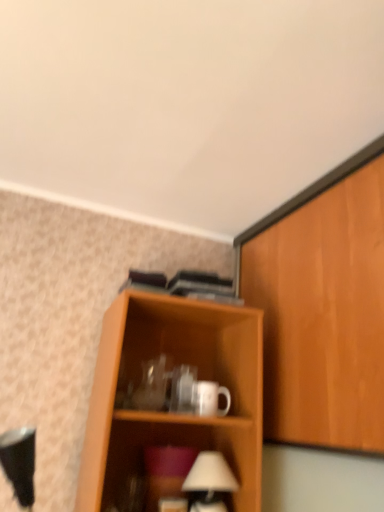
Image resolution: width=384 pixels, height=512 pixels. Describe the element at coordinates (209, 398) in the screenshot. I see `white glossy mug at center` at that location.

Locate an element on the screen. The width and height of the screenshot is (384, 512). wooden cabinet at right is located at coordinates (322, 307).

What do you see at coordinates (209, 482) in the screenshot?
I see `white matte table lamp at lower center` at bounding box center [209, 482].

Where is `white glossy mug at center`? This screenshot has width=384, height=512. white glossy mug at center is located at coordinates (209, 398).

In the image, there is a white matte table lamp at lower center. What are the coordinates of `mug above it (from the image's perspective)` in the screenshot? It's located at pyautogui.click(x=209, y=398).

From the picture: Considering the positions of objects white matte table lamp at lower center and white glossy mug at center in the image provided, who is more to the left, white matte table lamp at lower center or white glossy mug at center?

Positioned to the left is white matte table lamp at lower center.

Is white matte table lamp at lower center not inside white glossy mug at center?

Yes, white matte table lamp at lower center is located beyond the bounds of white glossy mug at center.

Is white matte table lamp at lower center positioned behind white glossy mug at center?

No, white matte table lamp at lower center is closer to the viewer.

Could white glossy mug at center be considered to be inside wooden cabinet at right?

Actually, white glossy mug at center is outside wooden cabinet at right.

Consider the image. From a real-world perspective, is wooden cabinet at right located higher than white glossy mug at center?

Correct, in the physical world, wooden cabinet at right is higher than white glossy mug at center.

Can you tell me how much wooden cabinet at right and white glossy mug at center differ in facing direction?

wooden cabinet at right and white glossy mug at center are facing 86.6 degrees away from each other.

Which is further, (x=342, y=170) or (x=203, y=411)?

Point (x=203, y=411)

Is white glossy mug at center to the left of wooden cabinet at right from the viewer's perspective?

Yes, white glossy mug at center is to the left of wooden cabinet at right.

Which of these two, white glossy mug at center or wooden cabinet at right, stands taller?

With more height is wooden cabinet at right.

From the image's perspective, is white glossy mug at center beneath wooden cabinet at right?

Yes.

Consider the image. Between wooden cabinet at right and white matte table lamp at lower center, which one appears on the right side from the viewer's perspective?

wooden cabinet at right.

Can you confirm if wooden cabinet at right is thinner than white matte table lamp at lower center?

Yes, wooden cabinet at right is thinner than white matte table lamp at lower center.

From a real-world perspective, is wooden cabinet at right positioned under white matte table lamp at lower center based on gravity?

Incorrect, from a real-world perspective, wooden cabinet at right is higher than white matte table lamp at lower center.

Measure the distance from wooden cabinet at right to white matte table lamp at lower center.

wooden cabinet at right and white matte table lamp at lower center are 20.62 inches apart.

Considering the positions of objects white glossy mug at center and white matte table lamp at lower center in the image provided, who is more to the right, white glossy mug at center or white matte table lamp at lower center?

white glossy mug at center.

Considering their positions, is white glossy mug at center located in front of or behind white matte table lamp at lower center?

white glossy mug at center is behind white matte table lamp at lower center.

From a real-world perspective, which object rests below the other?

white matte table lamp at lower center.

Where is `table lamp on the left side of white glossy mug at center`? This screenshot has width=384, height=512. table lamp on the left side of white glossy mug at center is located at coordinates (209, 482).

Based on the photo, how many degrees apart are the facing directions of white matte table lamp at lower center and wooden cabinet at right?

There is a 86.6-degree angle between the facing directions of white matte table lamp at lower center and wooden cabinet at right.

Is white matte table lamp at lower center not within wooden cabinet at right?

Indeed, white matte table lamp at lower center is completely outside wooden cabinet at right.

From a real-world perspective, who is located higher, white matte table lamp at lower center or wooden cabinet at right?

wooden cabinet at right, from a real-world perspective.

Is white matte table lamp at lower center positioned in front of wooden cabinet at right?

No, the depth of white matte table lamp at lower center is greater than that of wooden cabinet at right.

This screenshot has width=384, height=512. Find the location of `mug behind the white matte table lamp at lower center`. mug behind the white matte table lamp at lower center is located at coordinates (209, 398).

In the image, there is a wooden cabinet at right. In order to click on mug below it (from the image's perspective) in this screenshot , I will do pyautogui.click(x=209, y=398).

Which object lies nearer to the anchor point white glossy mug at center, wooden cabinet at right or white matte table lamp at lower center?

white matte table lamp at lower center lies closer to white glossy mug at center than the other object.

Considering their positions, is white glossy mug at center positioned closer to wooden cabinet at right than white matte table lamp at lower center?

Based on the image, white glossy mug at center appears to be nearer to wooden cabinet at right.

Estimate the real-world distances between objects in this image. Which object is further from white matte table lamp at lower center, wooden cabinet at right or white glossy mug at center?

Among the two, wooden cabinet at right is located further to white matte table lamp at lower center.

Which object lies further to the anchor point white matte table lamp at lower center, white glossy mug at center or wooden cabinet at right?

wooden cabinet at right is further to white matte table lamp at lower center.

Looking at this image, based on their spatial positions, is white matte table lamp at lower center or wooden cabinet at right further from white glossy mug at center?

wooden cabinet at right.

From the image, which object appears to be nearer to wooden cabinet at right, white matte table lamp at lower center or white glossy mug at center?

white glossy mug at center is positioned closer to the anchor wooden cabinet at right.

You are a GUI agent. You are given a task and a screenshot of the screen. Output one action in this format:
    pyautogui.click(x=<x>, y=<y>)
    Task: Click on the table lamp between wooden cabinet at right and white glossy mug at center from front to back
    
    Given the screenshot: What is the action you would take?
    pyautogui.click(x=209, y=482)